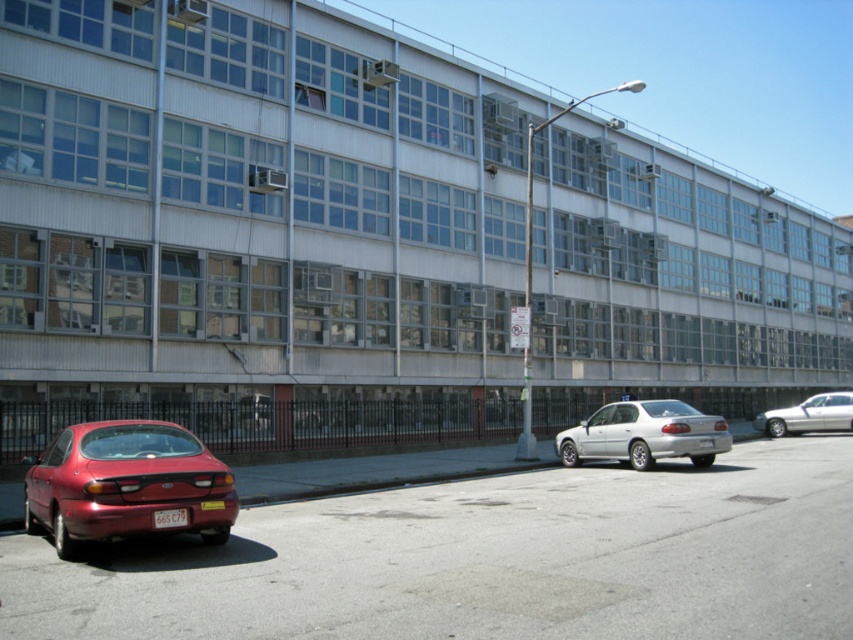
Which is more to the left, shiny red sedan at lower left or silver metallic sedan at right?

Positioned to the left is shiny red sedan at lower left.

Can you confirm if shiny red sedan at lower left is positioned below silver metallic sedan at right?

No, shiny red sedan at lower left is not below silver metallic sedan at right.

Does point (134, 480) come behind point (831, 428)?

That is False.

You are a GUI agent. You are given a task and a screenshot of the screen. Output one action in this format:
    pyautogui.click(x=<x>, y=<y>)
    Task: Click on the shiny red sedan at lower left
    This screenshot has height=640, width=853.
    Given the screenshot: What is the action you would take?
    pyautogui.click(x=125, y=483)

Is silver metallic sedan at center-right taller than red plastic license plate at lower left?

Yes.

Who is more distant from viewer, (664, 445) or (167, 524)?

The point (664, 445) is more distant.

Find the location of a particular element. This screenshot has width=853, height=640. silver metallic sedan at center-right is located at coordinates (643, 435).

In the scene shown: Which is more to the right, silver metallic sedan at right or red plastic license plate at lower left?

silver metallic sedan at right is more to the right.

I want to click on silver metallic sedan at right, so click(808, 416).

Locate an element on the screen. Image resolution: width=853 pixels, height=640 pixels. silver metallic sedan at right is located at coordinates (808, 416).

I want to click on silver metallic sedan at right, so click(x=808, y=416).